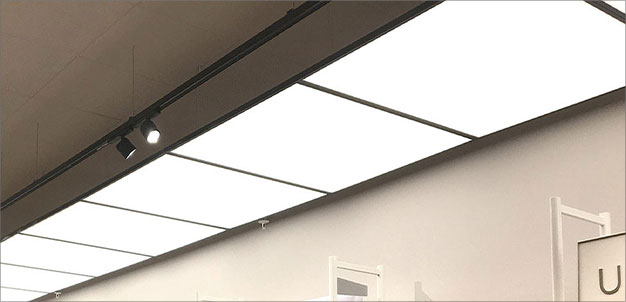
Where is `wall`? The height and width of the screenshot is (302, 626). wall is located at coordinates (479, 240).